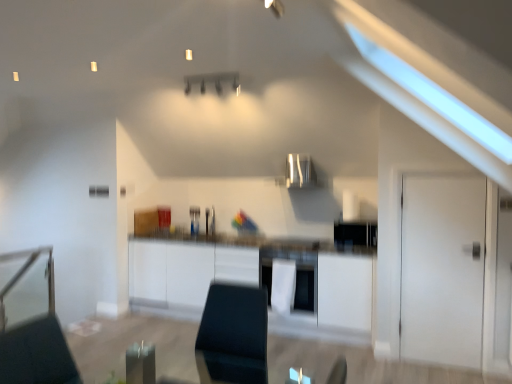
Question: From a real-world perspective, is white matte door at right positioned above or below white glossy oven at center?

Choices:
 (A) below
 (B) above

Answer: (B)

Question: Considering their positions, is white matte door at right located in front of or behind white glossy oven at center?

Choices:
 (A) front
 (B) behind

Answer: (A)

Question: Based on their relative distances, which object is nearer to the white glossy oven at center?

Choices:
 (A) white matte cabinet at center
 (B) white matte door at right
 (C) satin silver exhaust hood at center

Answer: (A)

Question: Which is farther from the white matte cabinet at center?

Choices:
 (A) satin silver exhaust hood at center
 (B) white glossy oven at center
 (C) white matte door at right

Answer: (A)